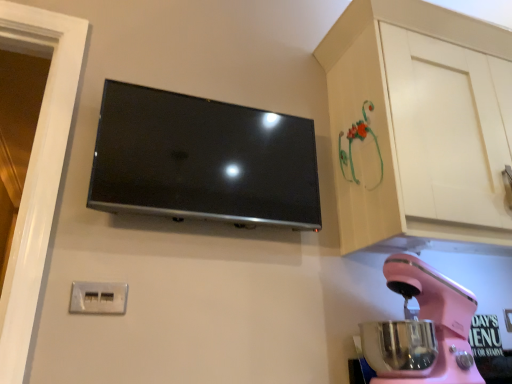
Question: In terms of height, does pink plastic stand mixer at lower right look taller or shorter compared to matte white cabinet at upper right?

Choices:
 (A) tall
 (B) short

Answer: (B)

Question: From a real-world perspective, is pink plastic stand mixer at lower right positioned above or below matte white cabinet at upper right?

Choices:
 (A) above
 (B) below

Answer: (B)

Question: Which object is positioned closest to the matte white cabinet at upper right?

Choices:
 (A) pink plastic stand mixer at lower right
 (B) matte black tv at upper center
 (C) white plastic electrical outlet at lower left

Answer: (A)

Question: Estimate the real-world distances between objects in this image. Which object is closer to the pink plastic stand mixer at lower right?

Choices:
 (A) white plastic electrical outlet at lower left
 (B) matte black tv at upper center
 (C) matte white cabinet at upper right

Answer: (C)